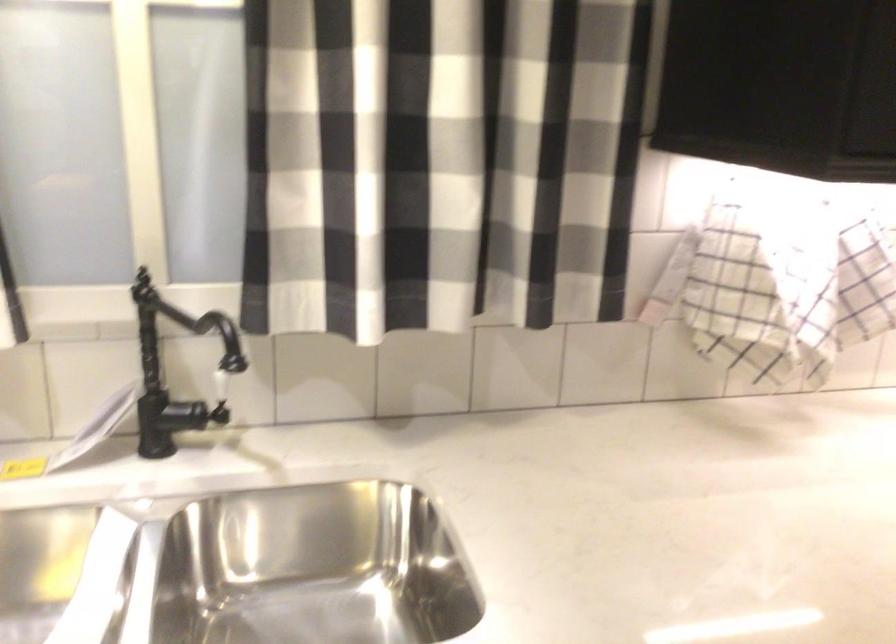
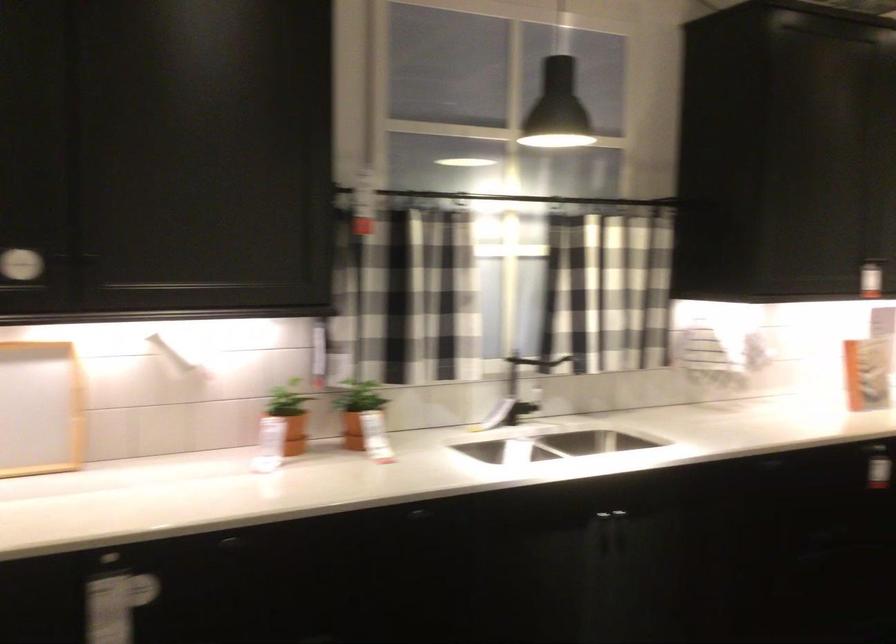
Find the pixel in the second image that matches [179,321] in the first image.

(520, 370)